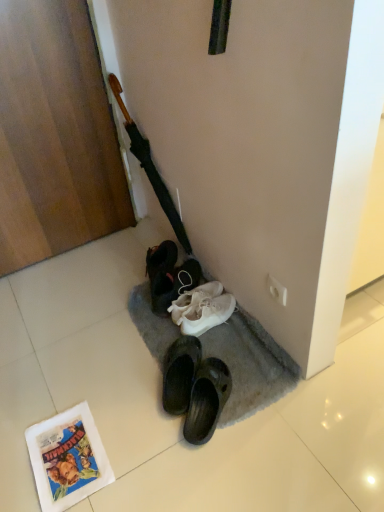
Question: In terms of size, does white paper comic book at lower left appear bigger or smaller than wooden door at left?

Choices:
 (A) big
 (B) small

Answer: (B)

Question: Considering the positions of white paper comic book at lower left and wooden door at left in the image, is white paper comic book at lower left taller or shorter than wooden door at left?

Choices:
 (A) tall
 (B) short

Answer: (B)

Question: Which of these objects is positioned farthest from the wooden crucifix at upper left?

Choices:
 (A) white paper comic book at lower left
 (B) wooden door at left
 (C) gray carpet at lower center
 (D) white fabric shoe at lower center

Answer: (A)

Question: Estimate the real-world distances between objects in this image. Which object is closer to the white paper comic book at lower left?

Choices:
 (A) white fabric shoe at lower center
 (B) wooden crucifix at upper left
 (C) gray carpet at lower center
 (D) wooden door at left

Answer: (C)